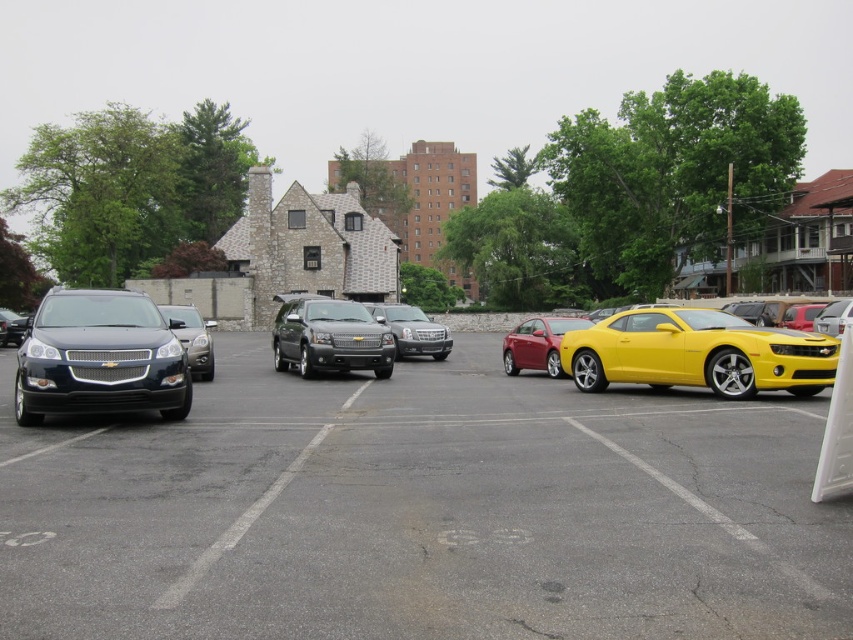
What do you see at coordinates (422, 512) in the screenshot? The width and height of the screenshot is (853, 640). I see `matte black car at left` at bounding box center [422, 512].

Does matte black car at left appear on the right side of satin black sedan at center?

Indeed, matte black car at left is positioned on the right side of satin black sedan at center.

This screenshot has width=853, height=640. I want to click on matte black car at left, so click(422, 512).

In order to click on matte black car at left in this screenshot , I will do `click(422, 512)`.

Between point (639, 372) and point (819, 317), which one is positioned behind?

The point (819, 317) is behind.

Can you confirm if yellow matte/satin sports car at right is positioned to the right of yellow matte car at center?

Incorrect, yellow matte/satin sports car at right is not on the right side of yellow matte car at center.

Which is behind, point (647, 340) or point (836, 301)?

Point (836, 301)

Image resolution: width=853 pixels, height=640 pixels. Find the location of `yellow matte/satin sports car at right`. yellow matte/satin sports car at right is located at coordinates (697, 353).

Based on the photo, can you confirm if matte black suv at left is thinner than satin silver suv at center?

Yes, matte black suv at left is thinner than satin silver suv at center.

Which is behind, point (33, 364) or point (440, 344)?

The point (440, 344) is behind.

The width and height of the screenshot is (853, 640). In order to click on matte black suv at left in this screenshot , I will do `click(99, 356)`.